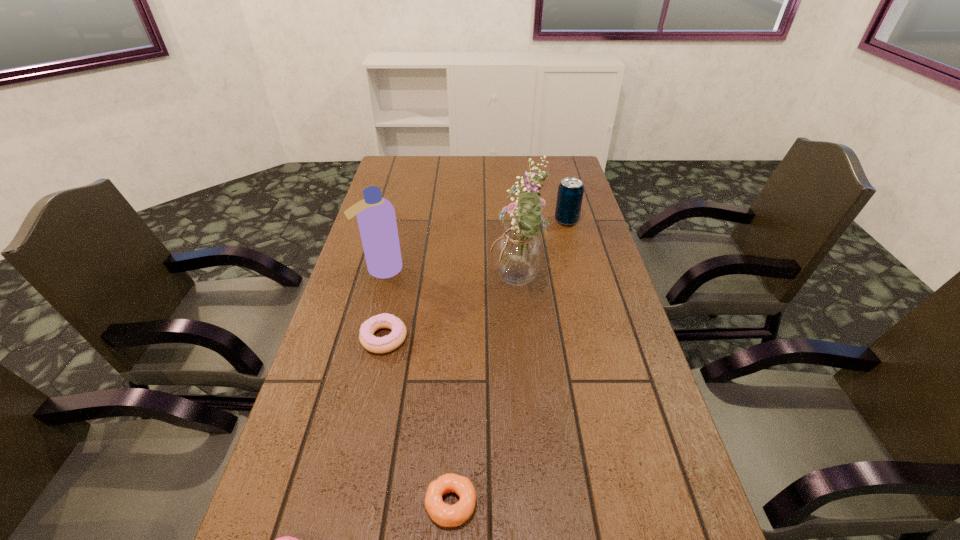
Where is `the closest doughnut to the fifth farthest object`? the closest doughnut to the fifth farthest object is located at coordinates (286, 539).

Identify which doughnut is the second closest to the fifth object from left to right. Please provide its 2D coordinates. Your answer should be formatted as a tuple, i.e. [(x, y)], where the tuple contains the x and y coordinates of a point satisfying the conditions above.

[(443, 514)]

The height and width of the screenshot is (540, 960). What are the coordinates of `free region that satisfies the following two spatial constraints: 1. on the front-facing side of the second object from right to left; 2. on the front side of the rightmost doughnut` in the screenshot? It's located at (538, 503).